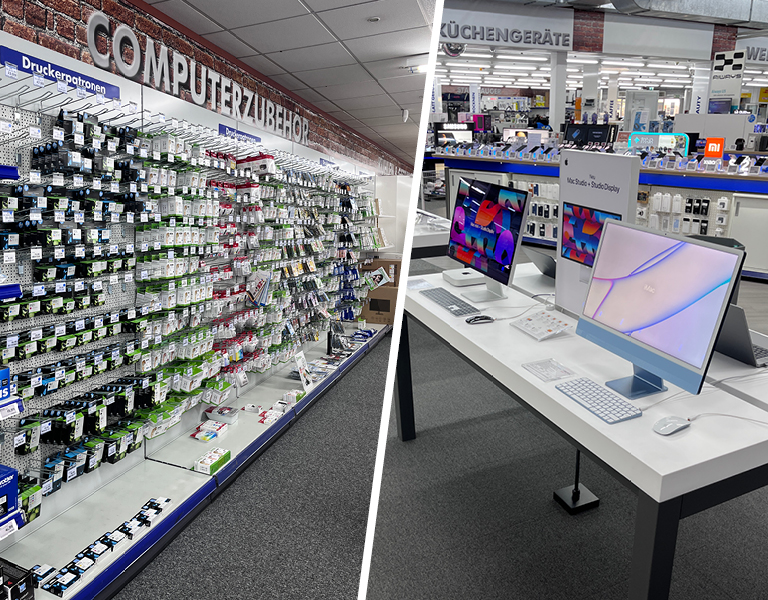
What are the coordinates of `carpet` in the screenshot? It's located at (478, 564).